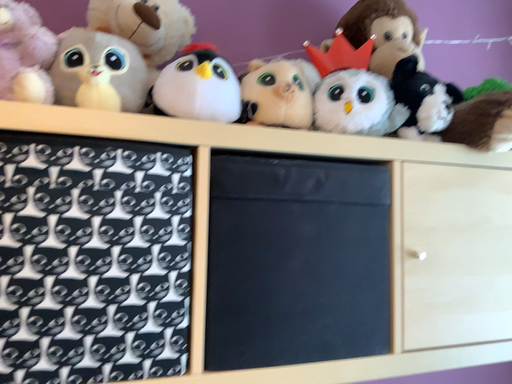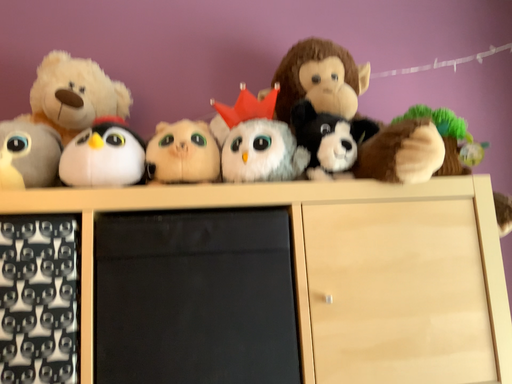
Question: Which way did the camera rotate in the video?

Choices:
 (A) rotated left
 (B) rotated right

Answer: (A)